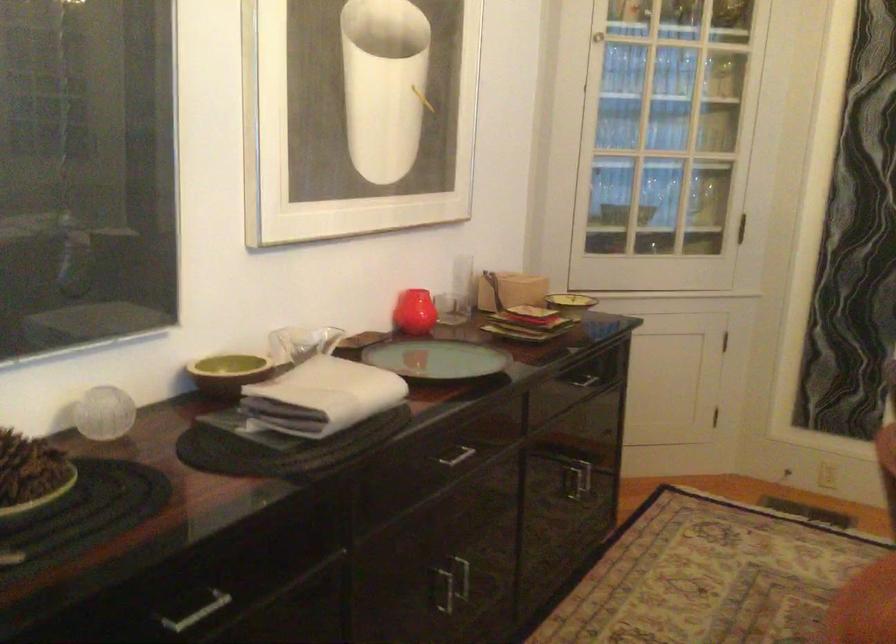
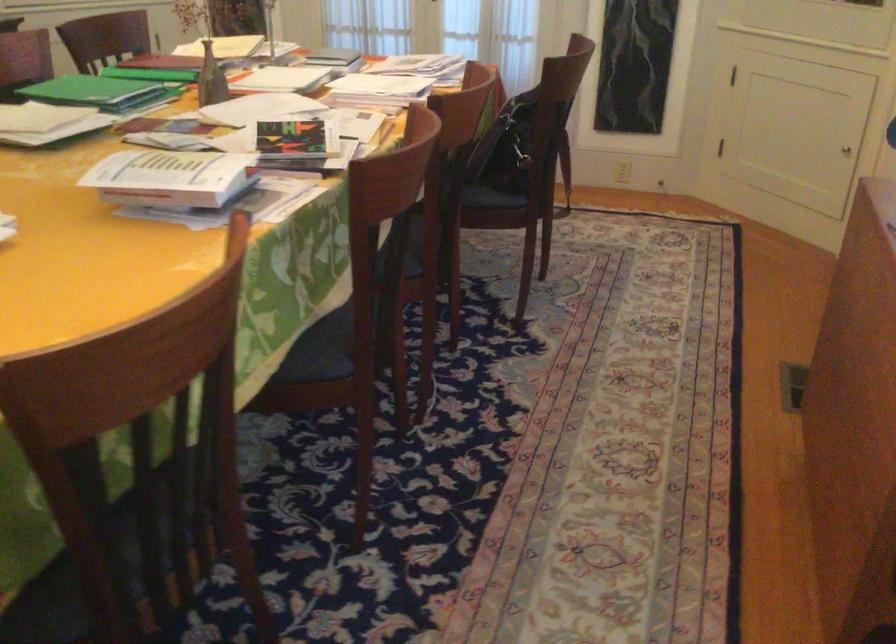
In a continuous first-person perspective shot, in which direction is the camera moving?

The cameraman walked toward right, backward.